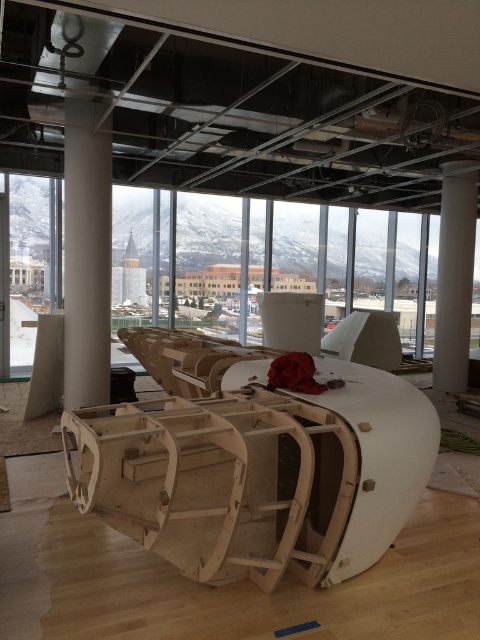
You are standing in the room and want to place a small plant between the two points, point (283, 401) and point (96, 376). Which point should the plant be closer to in order to be nearer to the viewer?

The plant should be placed closer to point (283, 401) because it is closer to the viewer than point (96, 376).

You are an interior designer assessing the space. You need to move the white smooth column at left closer to the natural wood boat at center. Is the column currently positioned farther away from you than the boat?

The natural wood boat at center is closer to the viewer than the white smooth column at left, so yes, the column is farther away and would need to be moved closer.